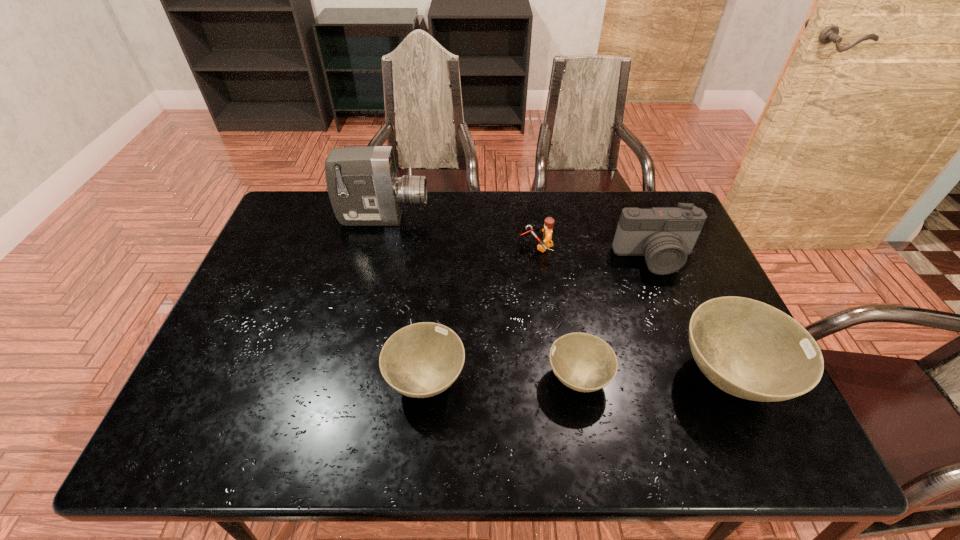
Locate an element on the screen. This screenshot has width=960, height=540. vacant point that satisfies the following two spatial constraints: 1. holding a crossbow in the hands of the shortest bowl; 2. on the right side of the Lego is located at coordinates (554, 379).

Find the location of a particular element. Image resolution: width=960 pixels, height=540 pixels. vacant region that satisfies the following two spatial constraints: 1. on the back side of the second tallest bowl; 2. at the front of the farthest object, highlighting the lens is located at coordinates (442, 218).

Image resolution: width=960 pixels, height=540 pixels. In order to click on free region that satisfies the following two spatial constraints: 1. at the front of the camcorder, highlighting the lens; 2. on the right side of the leftmost bowl in this screenshot , I will do `click(345, 380)`.

Identify the location of free location that satisfies the following two spatial constraints: 1. on the back side of the rightmost bowl; 2. at the front of the farthest object, highlighting the lens. This screenshot has height=540, width=960. (658, 218).

Locate an element on the screen. The width and height of the screenshot is (960, 540). vacant space that satisfies the following two spatial constraints: 1. at the front of the farthest object, highlighting the lens; 2. on the right side of the leftmost bowl is located at coordinates (345, 380).

Find the location of a particular element. The height and width of the screenshot is (540, 960). free space that satisfies the following two spatial constraints: 1. on the back side of the rightmost bowl; 2. at the front of the tallest object, highlighting the lens is located at coordinates (658, 218).

The image size is (960, 540). In order to click on blank space that satisfies the following two spatial constraints: 1. at the front of the rightmost bowl, highlighting the lens; 2. on the left side of the camcorder in this screenshot , I will do `click(346, 377)`.